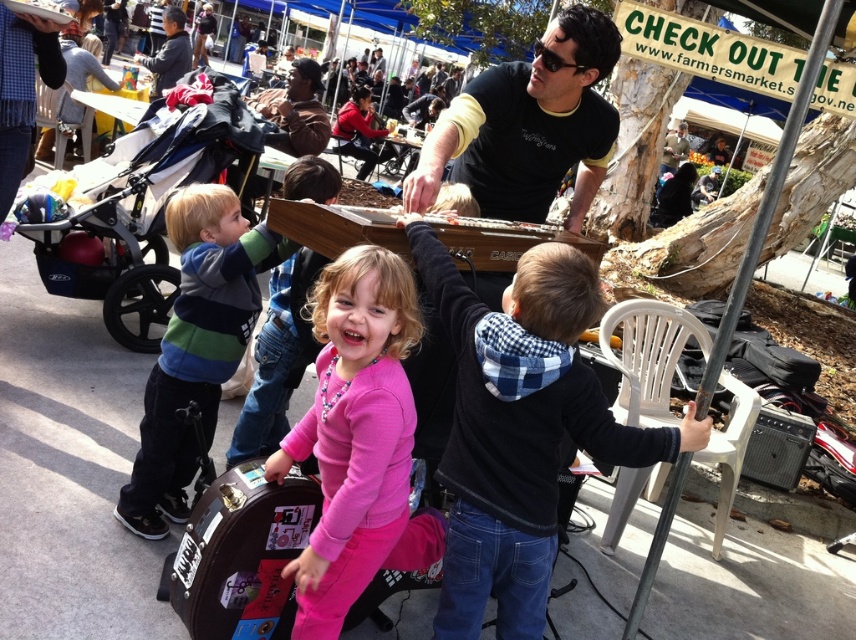
You are a photographer at the farmers market. You want to take a photo that includes both the pink matte dress at center and the black matte shirt at upper center. Which one should you focus on first to ensure both are in frame?

The pink matte dress at center is below the black matte shirt at upper center, so you should focus on the black matte shirt at upper center first to ensure both are in frame.